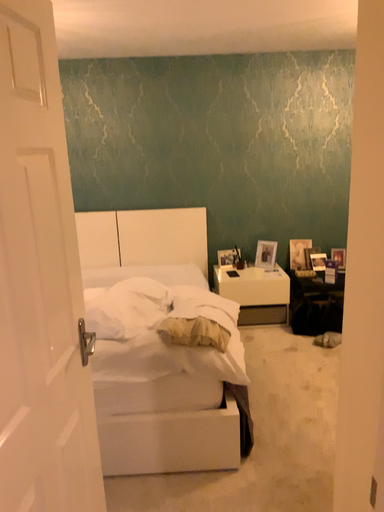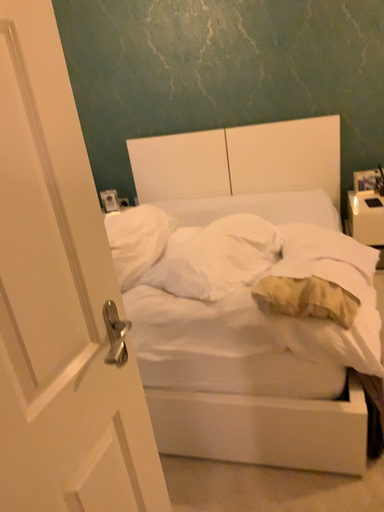
Question: Which way did the camera rotate in the video?

Choices:
 (A) rotated upward
 (B) rotated downward

Answer: (B)